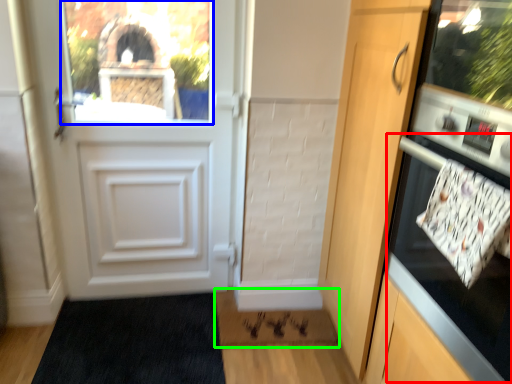
Question: Based on their relative distances, which object is nearer to oven (highlighted by a red box)? Choose from window screen (highlighted by a blue box) and doormat (highlighted by a green box).

Choices:
 (A) window screen
 (B) doormat

Answer: (B)